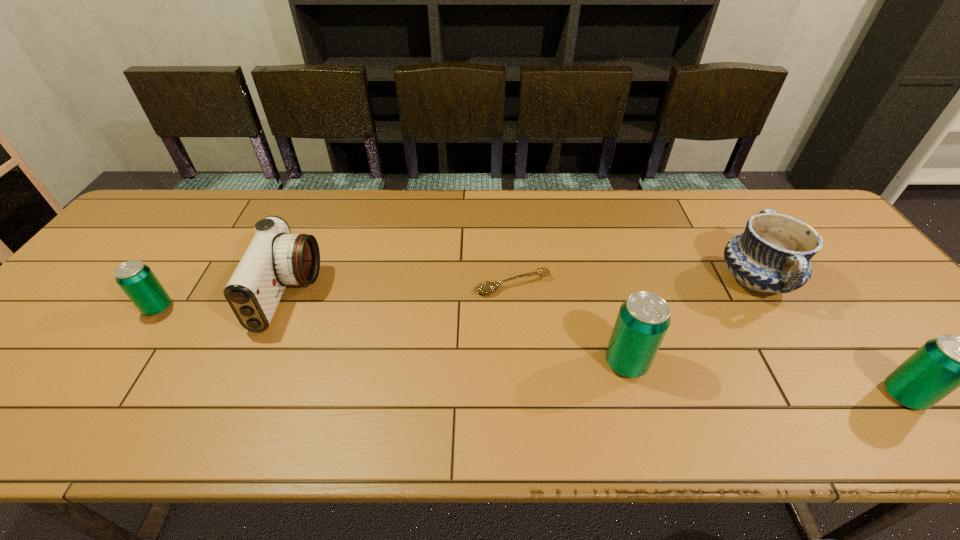
Locate an element on the screen. Image resolution: width=960 pixels, height=540 pixels. vacant space that satisfies the following two spatial constraints: 1. on the surface of the second object from left to right; 2. on the left side of the second beer can from right to left is located at coordinates tap(260, 363).

In order to click on vacant area in the image that satisfies the following two spatial constraints: 1. on the front side of the rightmost beer can; 2. on the right side of the ladle in this screenshot , I will do `click(521, 395)`.

Identify the location of vacant region that satisfies the following two spatial constraints: 1. on the back side of the rightmost object; 2. on the surface of the second object from left to right. (828, 294).

Where is `free space in the image that satisfies the following two spatial constraints: 1. on the back side of the third object from left to right; 2. on the right side of the shortest beer can`? The image size is (960, 540). free space in the image that satisfies the following two spatial constraints: 1. on the back side of the third object from left to right; 2. on the right side of the shortest beer can is located at coordinates (174, 285).